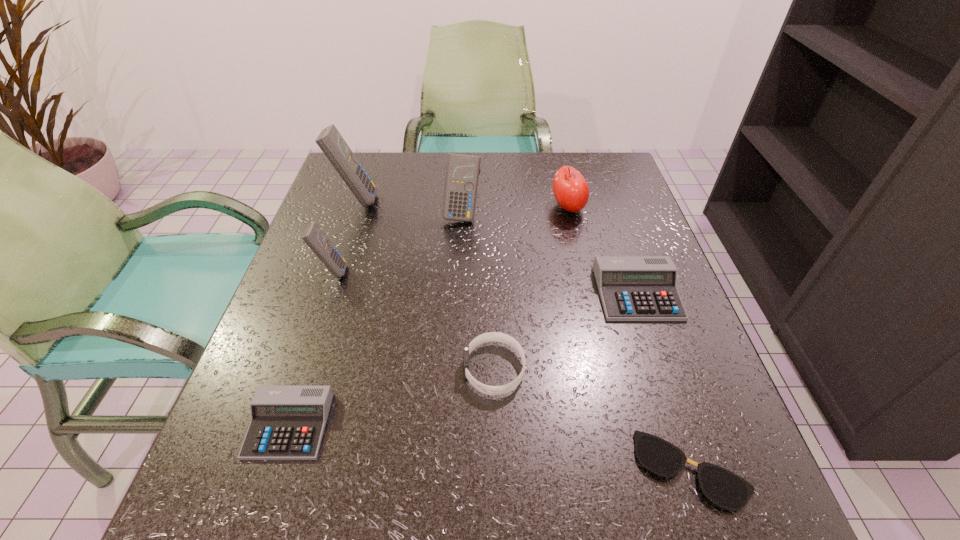
You are a GUI agent. You are given a task and a screenshot of the screen. Output one action in this format:
    pyautogui.click(x=<x>, y=<y>)
    Task: Click on the nearer gray calculator
    
    Given the screenshot: What is the action you would take?
    pyautogui.click(x=287, y=422)

Locate an element on the screen. the smaller gray calculator is located at coordinates (287, 422).

Where is `the shortest object`? The image size is (960, 540). the shortest object is located at coordinates (722, 487).

Image resolution: width=960 pixels, height=540 pixels. I want to click on free space located on the front-facing side of the biggest blue calculator, so click(508, 200).

The height and width of the screenshot is (540, 960). I want to click on vacant space located 0.380m on the front-facing side of the second biggest blue calculator, so click(455, 359).

Find the location of a particular element. This screenshot has height=540, width=960. vacant space located 0.230m on the front-facing side of the smallest blue calculator is located at coordinates (455, 271).

Identify the location of vacant space located 0.110m on the front of the apple. This screenshot has width=960, height=540. (x=578, y=252).

Locate an element on the screen. This screenshot has height=540, width=960. blank space located on the back of the rightmost calculator is located at coordinates (612, 220).

Find the location of a particular element. Image resolution: width=960 pixels, height=540 pixels. free space located 0.190m on the outer surface of the wristband is located at coordinates (356, 369).

Locate an element on the screen. free space located on the outer surface of the wristband is located at coordinates (310, 369).